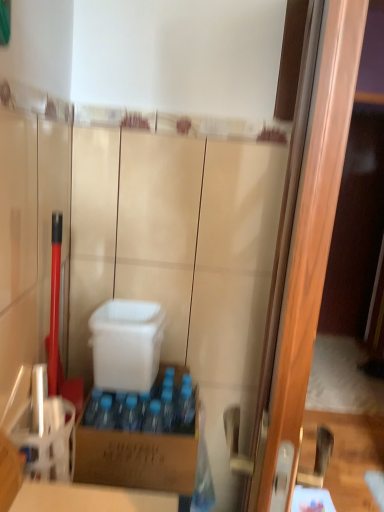
Question: Choose the correct answer: Is brown cardboard box at center, placed as the 1th box when sorted from bottom to top, inside white plastic container at center, which ranks as the 2th box in bottom-to-top order, or outside it?

Choices:
 (A) outside
 (B) inside

Answer: (A)

Question: In the image, is brown cardboard box at center, the second box when ordered from top to bottom, on the left side or the right side of white plastic container at center, which is counted as the 1th box, starting from the top?

Choices:
 (A) left
 (B) right

Answer: (B)

Question: Estimate the real-world distances between objects in this image. Which object is farther from the wooden screen door at right?

Choices:
 (A) brown cardboard box at center, the second box when ordered from top to bottom
 (B) white plastic container at center, which is counted as the 1th box, starting from the top

Answer: (B)

Question: Estimate the real-world distances between objects in this image. Which object is farther from the white plastic container at center, which is counted as the 1th box, starting from the top?

Choices:
 (A) brown cardboard box at center, the second box when ordered from top to bottom
 (B) wooden screen door at right

Answer: (B)